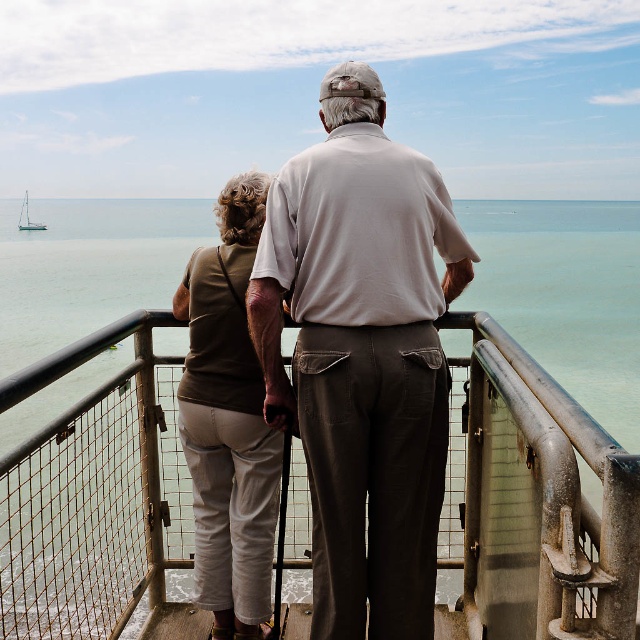
Question: Which point appears closest to the camera in this image?

Choices:
 (A) (316, 448)
 (B) (19, 227)
 (C) (246, 353)
 (D) (600, 522)

Answer: (D)

Question: Does white cotton shirt at center come behind white sailboat at left?

Choices:
 (A) no
 (B) yes

Answer: (A)

Question: Which of these objects is positioned farthest from the white cotton shirt at center?

Choices:
 (A) matte green shirt at center
 (B) metallic silver railing at center

Answer: (B)

Question: Which point is closer to the camera?

Choices:
 (A) (349, 467)
 (B) (10, 458)
 (C) (22, 227)
 (D) (192, 388)

Answer: (B)

Question: Is white cotton shirt at center in front of white sailboat at left?

Choices:
 (A) yes
 (B) no

Answer: (A)

Question: Does matte green shirt at center appear on the left side of white sailboat at left?

Choices:
 (A) yes
 (B) no

Answer: (B)